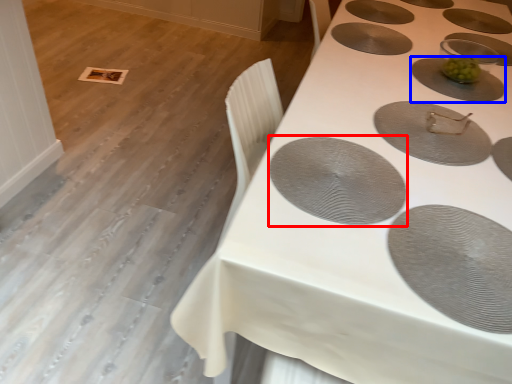
Question: Which object appears closest to the camera in this image, oval (highlighted by a red box) or oval (highlighted by a blue box)?

Choices:
 (A) oval
 (B) oval

Answer: (A)